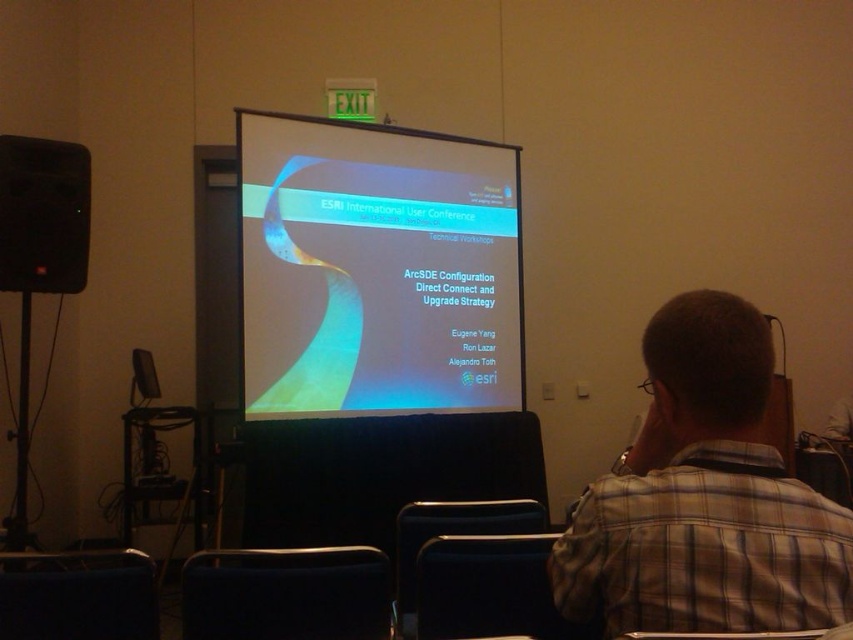
From the picture: Does matte plastic screen at center appear under plaid shirt at center?

No, matte plastic screen at center is not below plaid shirt at center.

Does point (509, 243) lie in front of point (746, 324)?

That is False.

In order to click on matte plastic screen at center in this screenshot , I will do `click(376, 269)`.

Is matte plastic screen at center to the right of black matte speaker at left from the viewer's perspective?

Yes, matte plastic screen at center is to the right of black matte speaker at left.

Where is `matte plastic screen at center`? The width and height of the screenshot is (853, 640). matte plastic screen at center is located at coordinates (376, 269).

Which is in front, point (631, 628) or point (79, 170)?

Point (631, 628) is more forward.

Consider the image. Does plaid shirt at center have a smaller size compared to black matte speaker at left?

Incorrect, plaid shirt at center is not smaller in size than black matte speaker at left.

Does point (708, 372) come closer to viewer compared to point (25, 163)?

Yes, it is in front of point (25, 163).

At what (x,y) coordinates should I click in order to perform the action: click on plaid shirt at center. Please return your answer as a coordinate pair (x, y). Looking at the image, I should click on (704, 497).